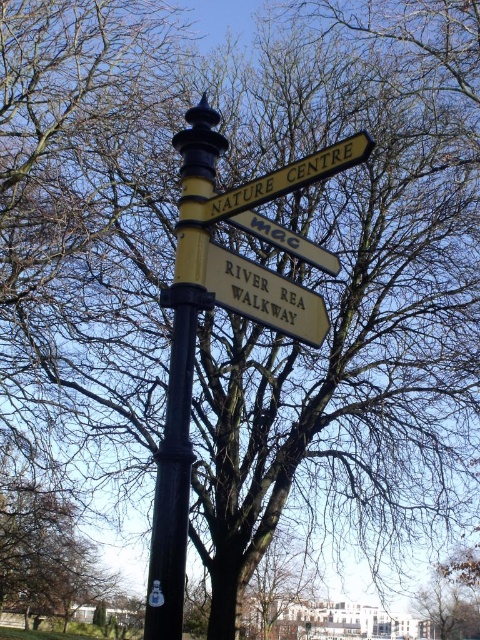
Measure the distance between black matte pole at center and bare branches at center.

They are 64.37 feet apart.

Is black matte pole at center smaller than bare branches at center?

Yes.

Is point (186, 252) farther from viewer compared to point (454, 572)?

No, it is in front of (454, 572).

Locate an element on the screen. The image size is (480, 640). black matte pole at center is located at coordinates [x=181, y=371].

Does bare branches at center have a lesser height compared to metallic silver sign at center?

No.

What do you see at coordinates (454, 596) in the screenshot?
I see `bare branches at center` at bounding box center [454, 596].

Measure the distance between bare branches at center and camera.

bare branches at center and camera are 22.32 meters apart.

Where is `bare branches at center`? This screenshot has width=480, height=640. bare branches at center is located at coordinates (454, 596).

The height and width of the screenshot is (640, 480). Identify the location of yellow painted wood sign at upper center. (289, 177).

Is point (328, 157) positioned in front of point (283, 237)?

That is True.

I want to click on yellow painted wood sign at upper center, so click(289, 177).